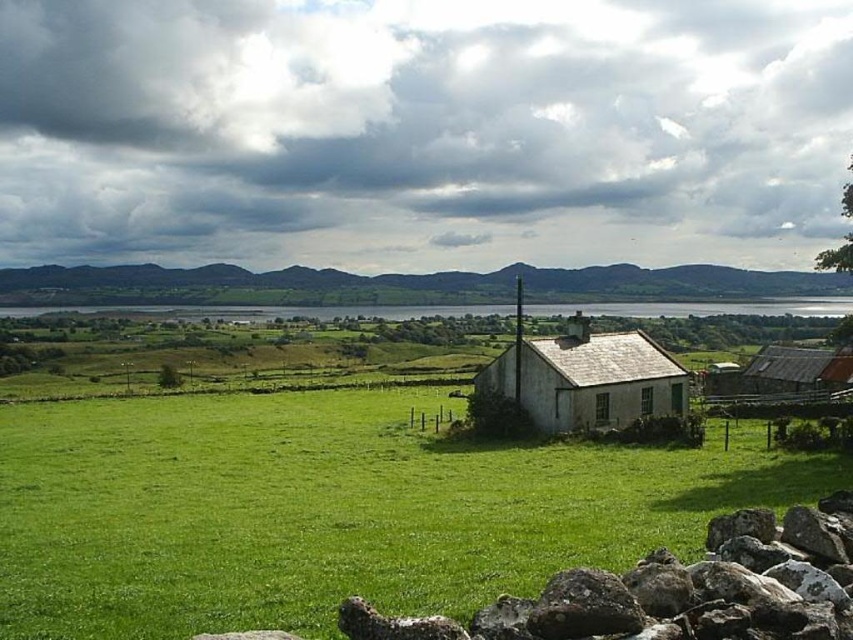
Is point (781, 538) closer to camera compared to point (657, 353)?

Yes.

Which is below, rough textured rock at lower right or white textured house at center?

Positioned lower is rough textured rock at lower right.

Locate an element on the screen. The image size is (853, 640). rough textured rock at lower right is located at coordinates (676, 589).

Does green grassy field at center appear on the left side of rough textured rock at lower right?

Correct, you'll find green grassy field at center to the left of rough textured rock at lower right.

Measure the distance between point (x=316, y=547) and camera.

Point (x=316, y=547) is 55.89 feet away from camera.

Locate an element on the screen. The image size is (853, 640). green grassy field at center is located at coordinates (332, 509).

Is green grassy field at center below white textured house at center?

Correct, green grassy field at center is located below white textured house at center.

Is point (543, 554) farther from camera compared to point (515, 396)?

No, it is in front of (515, 396).

Which is behind, point (358, 525) or point (612, 342)?

Point (612, 342)

The image size is (853, 640). Identify the location of green grassy field at center. 332,509.